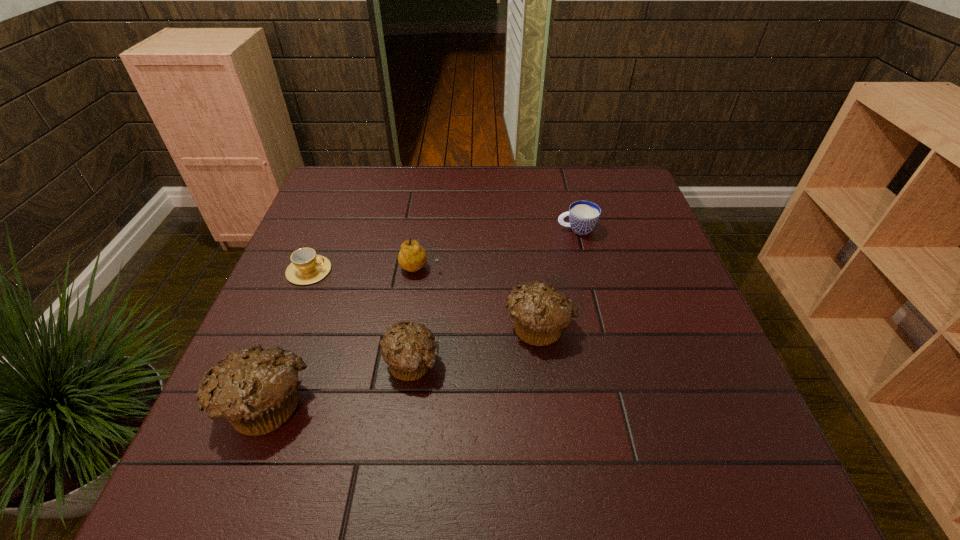
Image resolution: width=960 pixels, height=540 pixels. I want to click on object that is at the near left corner, so click(x=254, y=389).

What are the coordinates of `free region at the far edge of the desktop` in the screenshot? It's located at (552, 175).

In the image, there is a desktop. At what (x,y) coordinates should I click in order to perform the action: click on vacant space at the near edge. Please return your answer as a coordinate pair (x, y). Looking at the image, I should click on (448, 421).

The width and height of the screenshot is (960, 540). In order to click on blank space at the left edge of the desktop in this screenshot , I will do `click(318, 305)`.

Image resolution: width=960 pixels, height=540 pixels. Identify the location of vacant point at the right edge. (615, 276).

I want to click on vacant space at the far left corner of the desktop, so click(334, 176).

I want to click on blank space at the far right corner of the desktop, so click(589, 187).

Locate an element on the screen. The height and width of the screenshot is (540, 960). free space at the near right corner of the desktop is located at coordinates (684, 394).

You are a GUI agent. You are given a task and a screenshot of the screen. Output one action in this format:
    pyautogui.click(x=<x>, y=<y>)
    Task: Click on the vacant area that lies between the pear and the shortest muffin
    The height and width of the screenshot is (540, 960).
    Given the screenshot: What is the action you would take?
    pyautogui.click(x=416, y=314)

Where is `free space between the second muffin from right to left and the nearer cup`? free space between the second muffin from right to left and the nearer cup is located at coordinates (361, 316).